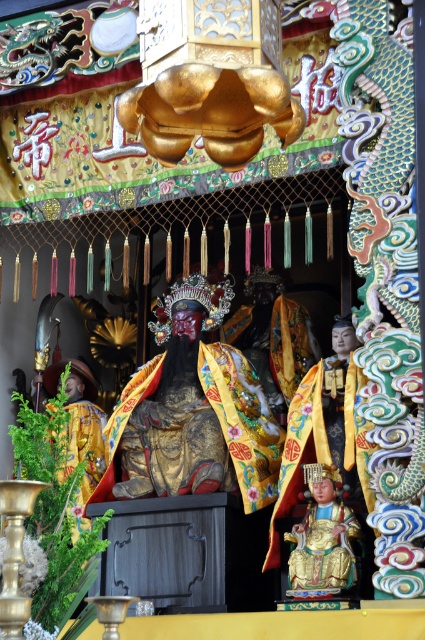
Based on the photo, does gold brocade robe at center have a greater height compared to gold lacquered statue at lower center?

Yes.

Between point (232, 394) and point (326, 554), which one is positioned behind?

Point (232, 394)

Image resolution: width=425 pixels, height=640 pixels. I want to click on gold brocade robe at center, so click(x=243, y=419).